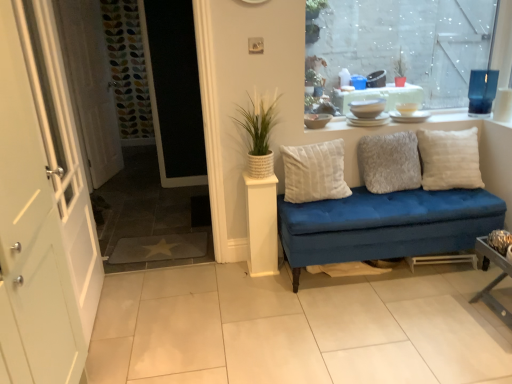
At what (x,y) coordinates should I click in order to perform the action: click on free point below metallic silver table at lower right, the first table viewed from the front (from a real-world perspective). Please return your answer as a coordinate pair (x, y). The image size is (512, 384). Looking at the image, I should click on (498, 310).